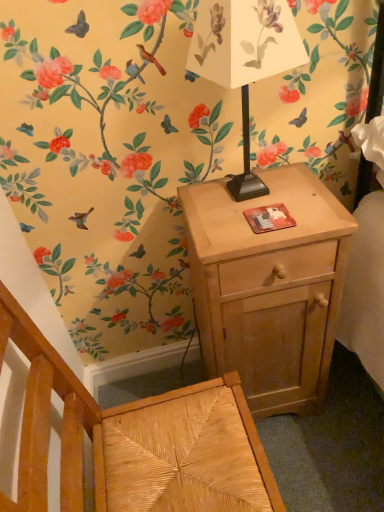
Find the location of a particular element. The image size is (384, 512). free space in front of white paper lampshade at upper center is located at coordinates (257, 234).